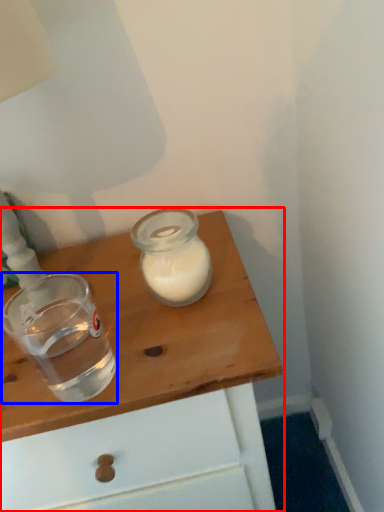
Question: Among these objects, which one is farthest to the camera, table (highlighted by a red box) or shot glass (highlighted by a blue box)?

Choices:
 (A) table
 (B) shot glass

Answer: (A)